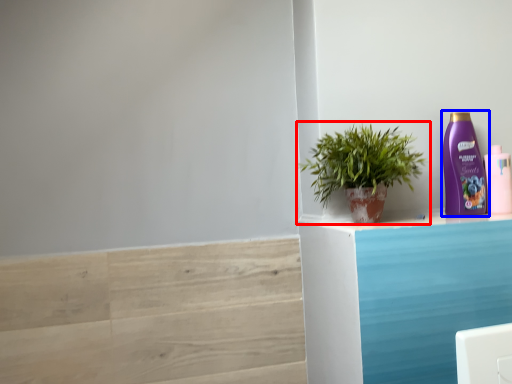
Question: Which object appears farthest to the camera in this image, houseplant (highlighted by a red box) or bottle (highlighted by a blue box)?

Choices:
 (A) houseplant
 (B) bottle

Answer: (B)